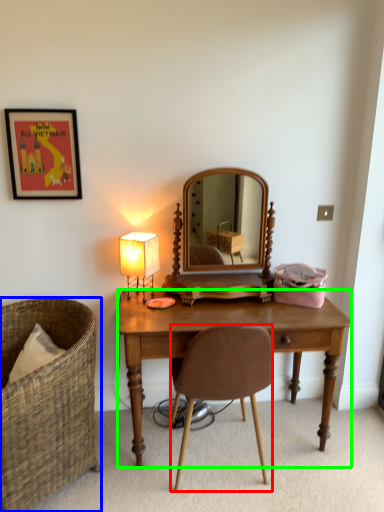
Question: Estimate the real-world distances between objects in this image. Which object is farther from chair (highlighted by a red box), chair (highlighted by a blue box) or desk (highlighted by a green box)?

Choices:
 (A) chair
 (B) desk

Answer: (A)